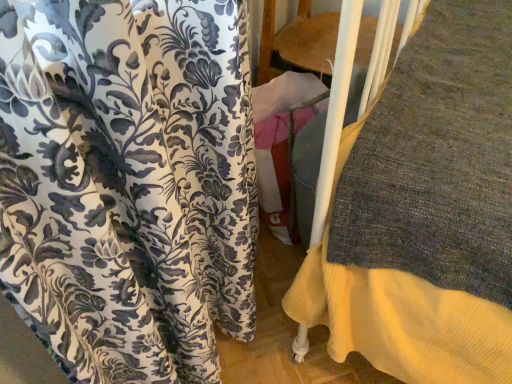
Question: From the image's perspective, is floral fabric curtain at left located above or below wooden bunk bed at center?

Choices:
 (A) below
 (B) above

Answer: (A)

Question: Based on their sizes in the image, would you say floral fabric curtain at left is bigger or smaller than wooden bunk bed at center?

Choices:
 (A) small
 (B) big

Answer: (A)

Question: Is floral fabric curtain at left taller or shorter than wooden bunk bed at center?

Choices:
 (A) tall
 (B) short

Answer: (B)

Question: Looking at the image, does wooden bunk bed at center seem bigger or smaller compared to floral fabric curtain at left?

Choices:
 (A) big
 (B) small

Answer: (A)

Question: Is wooden bunk bed at center in front of or behind floral fabric curtain at left in the image?

Choices:
 (A) front
 (B) behind

Answer: (B)

Question: Is wooden bunk bed at center spatially inside floral fabric curtain at left, or outside of it?

Choices:
 (A) inside
 (B) outside

Answer: (B)

Question: From their relative heights in the image, would you say wooden bunk bed at center is taller or shorter than floral fabric curtain at left?

Choices:
 (A) short
 (B) tall

Answer: (B)